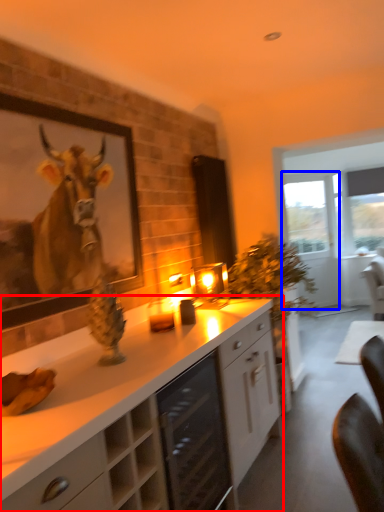
Question: Which point is further to the camera, cabinetry (highlighted by a red box) or glass door (highlighted by a blue box)?

Choices:
 (A) cabinetry
 (B) glass door

Answer: (B)